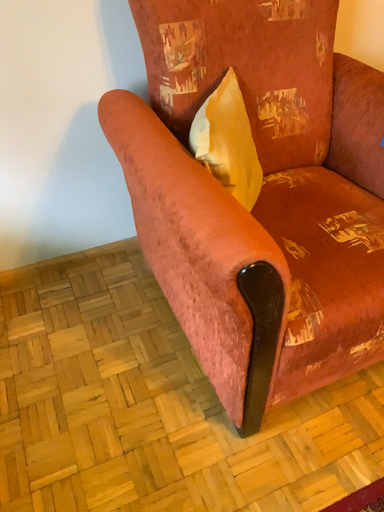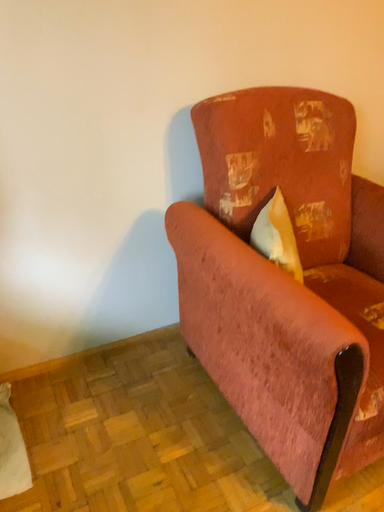
Question: Which way did the camera rotate in the video?

Choices:
 (A) rotated downward
 (B) rotated upward

Answer: (B)